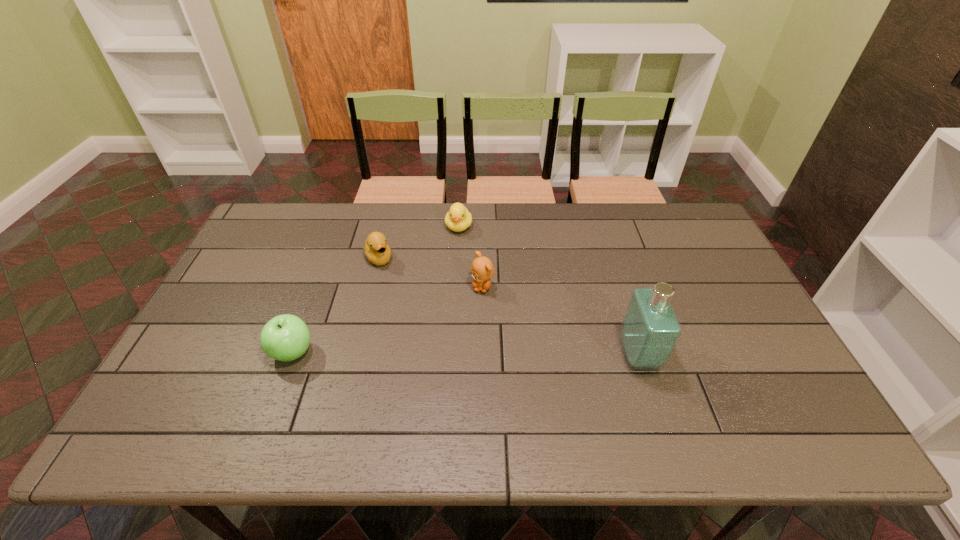
Where is `vacant region located 0.380m on the beak of the farthest object`? The width and height of the screenshot is (960, 540). vacant region located 0.380m on the beak of the farthest object is located at coordinates (444, 326).

At what (x,y) coordinates should I click in order to perform the action: click on vacant space located on the beak of the farthest object. Please return your answer as a coordinate pair (x, y). Looking at the image, I should click on (447, 299).

Find the location of a particular element. free space located on the beak of the farthest object is located at coordinates (448, 292).

Identify the location of vacant space located on the face of the third farthest object. Image resolution: width=960 pixels, height=540 pixels. (452, 380).

Identify the location of vacant space positioned 0.240m on the face of the third farthest object. (458, 363).

This screenshot has width=960, height=540. Find the location of `vacant region located on the face of the third farthest object`. vacant region located on the face of the third farthest object is located at coordinates (445, 402).

Find the location of a particular element. free space located facing forward on the left duckling is located at coordinates (411, 313).

This screenshot has height=540, width=960. In order to click on vacant space situated facing forward on the left duckling in this screenshot , I will do [435, 352].

Find the location of a particular element. The height and width of the screenshot is (540, 960). vacant position located 0.190m facing forward on the left duckling is located at coordinates (408, 309).

At what (x,y) coordinates should I click in order to perform the action: click on object positioned at the far edge. Please return your answer as a coordinate pair (x, y). Looking at the image, I should click on pyautogui.click(x=458, y=219).